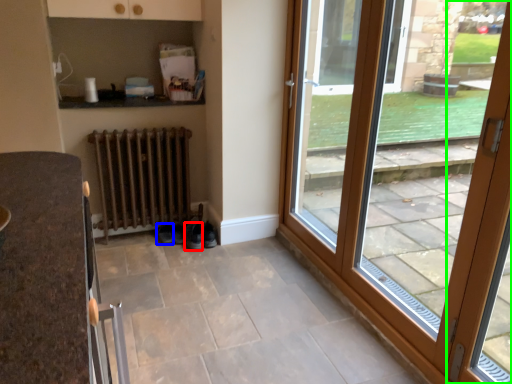
Question: Considering the real-world distances, which object is farthest from shoe (highlighted by a red box)? shoe (highlighted by a blue box) or door (highlighted by a green box)?

Choices:
 (A) shoe
 (B) door

Answer: (B)